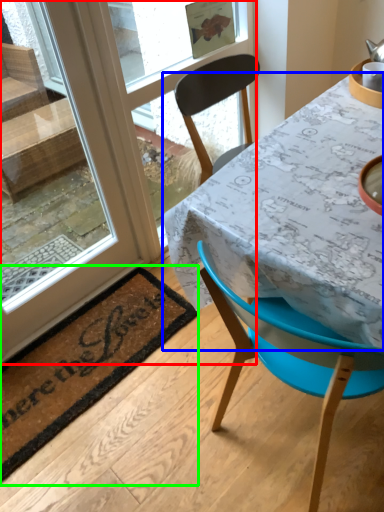
Question: Considering the real-world distances, which object is farthest from window (highlighted by a red box)? table (highlighted by a blue box) or mat (highlighted by a green box)?

Choices:
 (A) table
 (B) mat

Answer: (A)